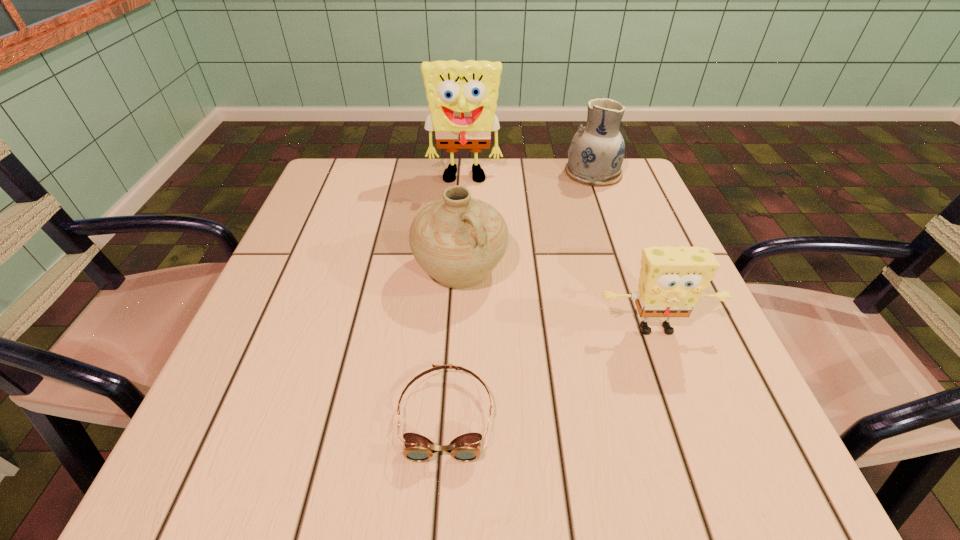
This screenshot has width=960, height=540. In the image, there is a desktop. In order to click on vacant space at the near edge in this screenshot , I will do `click(312, 449)`.

The width and height of the screenshot is (960, 540). In the image, there is a desktop. Find the location of `blank space at the left edge`. blank space at the left edge is located at coordinates (336, 276).

You are a GUI agent. You are given a task and a screenshot of the screen. Output one action in this format:
    pyautogui.click(x=<x>, y=<y>)
    Task: Click on the free location at the right edge
    
    Given the screenshot: What is the action you would take?
    click(x=699, y=374)

Where is `free space at the far left corner`? The image size is (960, 540). free space at the far left corner is located at coordinates (383, 163).

Where is `empty location between the shorter sponge and the right pottery`? empty location between the shorter sponge and the right pottery is located at coordinates click(624, 251).

The width and height of the screenshot is (960, 540). Identify the location of unoccupied area between the tallest object and the shortest object. (455, 297).

I want to click on free space between the left pottery and the farther pottery, so click(x=527, y=221).

You are a GUI agent. You are given a task and a screenshot of the screen. Output one action in this format:
    pyautogui.click(x=<x>, y=<y>)
    Task: Click on the vacant area that lies between the shorter sponge and the farther pottery
    This screenshot has height=540, width=960.
    Given the screenshot: What is the action you would take?
    pyautogui.click(x=624, y=251)

The height and width of the screenshot is (540, 960). I want to click on free space between the left sponge and the nearest object, so click(x=455, y=297).

The image size is (960, 540). Identify the location of empty location between the nearest object and the left pottery. [453, 342].